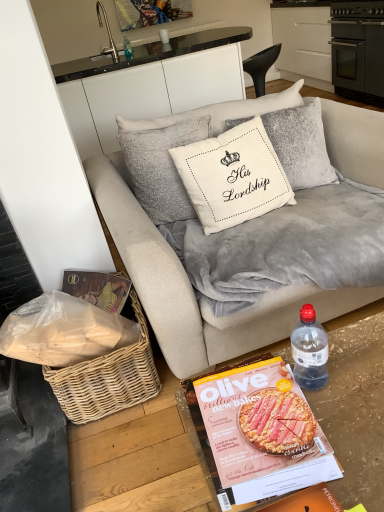
Question: Is white cotton cushion at center at the back of matte paper magazine at lower center?

Choices:
 (A) no
 (B) yes

Answer: (A)

Question: Does matte paper magazine at lower center have a greater width compared to white cotton cushion at center?

Choices:
 (A) no
 (B) yes

Answer: (B)

Question: Is matte paper magazine at lower center positioned far away from white cotton cushion at center?

Choices:
 (A) yes
 (B) no

Answer: (B)

Question: Is matte paper magazine at lower center further to camera compared to white cotton cushion at center?

Choices:
 (A) yes
 (B) no

Answer: (B)

Question: Does matte paper magazine at lower center have a greater height compared to white cotton cushion at center?

Choices:
 (A) yes
 (B) no

Answer: (B)

Question: Visually, is white cotton cushion at center positioned to the left or to the right of transparent plastic bottle at lower right, which is the 2th bottle from back to front?

Choices:
 (A) left
 (B) right

Answer: (A)

Question: Looking at their shapes, would you say white cotton cushion at center is wider or thinner than transparent plastic bottle at lower right, the 2th bottle when ordered from top to bottom?

Choices:
 (A) thin
 (B) wide

Answer: (B)

Question: Is point (200, 175) closer or farther from the camera than point (317, 331)?

Choices:
 (A) farther
 (B) closer

Answer: (A)

Question: Is white cotton cushion at center spatially inside transparent plastic bottle at lower right, which is the first bottle in front-to-back order, or outside of it?

Choices:
 (A) outside
 (B) inside

Answer: (A)

Question: Is white cotton cushion at center wider or thinner than woven wicker basket at lower left?

Choices:
 (A) thin
 (B) wide

Answer: (B)

Question: Is point (215, 139) closer or farther from the camera than point (87, 355)?

Choices:
 (A) closer
 (B) farther

Answer: (B)

Question: Based on their positions, is white cotton cushion at center located to the left or right of woven wicker basket at lower left?

Choices:
 (A) left
 (B) right

Answer: (B)

Question: Is white cotton cushion at center inside or outside of woven wicker basket at lower left?

Choices:
 (A) inside
 (B) outside

Answer: (B)

Question: Is silver metallic faucet at upper left taller or shorter than white glossy cup at upper center?

Choices:
 (A) tall
 (B) short

Answer: (A)

Question: Considering their positions, is silver metallic faucet at upper left located in front of or behind white glossy cup at upper center?

Choices:
 (A) front
 (B) behind

Answer: (A)